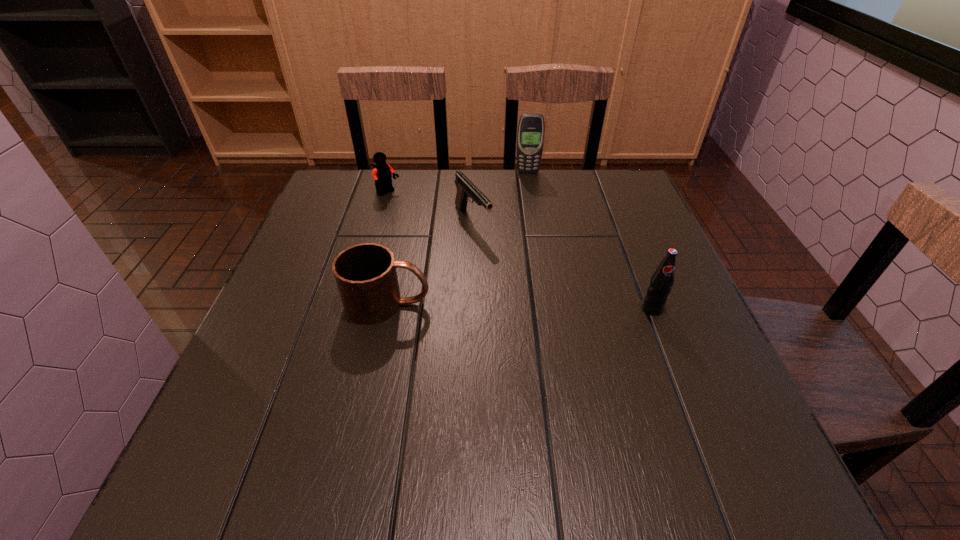
Identify the location of free space located on the front-facing side of the Lego. (473, 266).

The height and width of the screenshot is (540, 960). Find the location of `free location located 0.200m on the front-facing side of the Lego`. free location located 0.200m on the front-facing side of the Lego is located at coordinates (x=434, y=233).

Find the location of `blank space located on the front-facing side of the Lego`. blank space located on the front-facing side of the Lego is located at coordinates point(463,257).

Find the location of a particular element. This screenshot has width=960, height=540. vacant space situated 0.190m at the muzzle of the pistol is located at coordinates (522, 285).

Find the location of a particular element. vacant point located 0.170m at the muzzle of the pistol is located at coordinates (517, 280).

This screenshot has height=540, width=960. I want to click on free location located 0.170m at the muzzle of the pistol, so click(x=517, y=280).

Image resolution: width=960 pixels, height=540 pixels. I want to click on free space located on the screen of the fourth object from left to right, so [x=528, y=186].

Where is `free space located 0.090m on the screen of the fourth object from left to right`? free space located 0.090m on the screen of the fourth object from left to right is located at coordinates (529, 190).

This screenshot has height=540, width=960. In order to click on vacant space situated 0.380m on the screen of the fourth object from left to right in this screenshot , I will do `click(534, 255)`.

The image size is (960, 540). What are the coordinates of `Lego located at the far edge` in the screenshot? It's located at (382, 172).